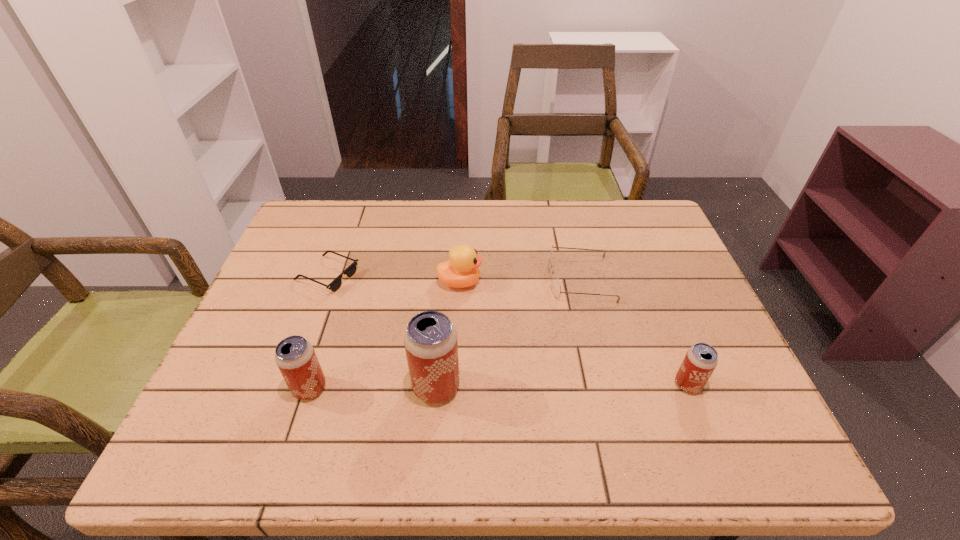
Find the location of a particular element. the fifth shortest object is located at coordinates (295, 357).

You are a GUI agent. You are given a task and a screenshot of the screen. Output one action in this format:
    pyautogui.click(x=<x>, y=<y>)
    Task: Click on the leftmost beer can
    The image size is (960, 540).
    Given the screenshot: What is the action you would take?
    pyautogui.click(x=295, y=357)

I want to click on the tallest object, so click(x=430, y=340).

The width and height of the screenshot is (960, 540). I want to click on the tallest beer can, so click(x=430, y=340).

Identify the location of the rightmost beer can. (701, 359).

At what (x,y) coordinates should I click in order to perform the action: click on the rightmost object. Please return your answer as a coordinate pair (x, y). The image size is (960, 540). Looking at the image, I should click on (701, 359).

What are the coordinates of `sunglasses` in the screenshot? It's located at (335, 285).

At what (x,y) coordinates should I click in order to perform the action: click on the second shortest object. Please return your answer as a coordinate pair (x, y). This screenshot has height=540, width=960. Looking at the image, I should click on (555, 284).

You are a GUI agent. You are given a task and a screenshot of the screen. Output one action in this format:
    pyautogui.click(x=<x>, y=<y>)
    Task: Click on the spectacles
    
    Given the screenshot: What is the action you would take?
    pyautogui.click(x=555, y=284)

The image size is (960, 540). I want to click on duckling, so click(x=461, y=271).